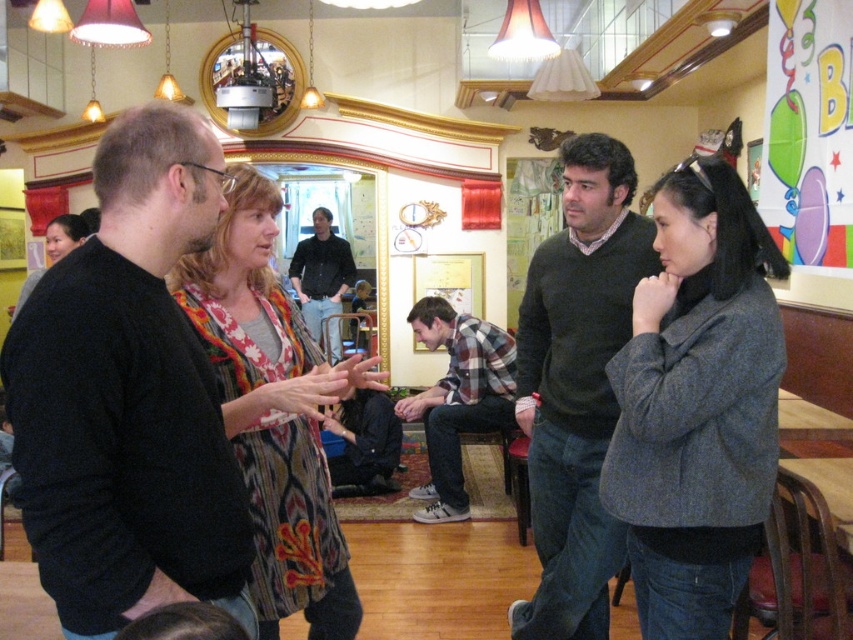
Question: Is flannel shirt at center below dark blue jeans at center?

Choices:
 (A) no
 (B) yes

Answer: (B)

Question: Among these objects, which one is farthest from the camera?

Choices:
 (A) multicolored woven scarf at center
 (B) dark blue jeans at center
 (C) flannel shirt at center

Answer: (B)

Question: Which object is the closest to the gray woolen jacket at right?

Choices:
 (A) dark blue jeans at center
 (B) multicolored woven scarf at center

Answer: (B)

Question: Is black matte sweater at left to the right of dark gray sweater at center from the viewer's perspective?

Choices:
 (A) no
 (B) yes

Answer: (A)

Question: Which of these objects is positioned farthest from the dark gray sweater at center?

Choices:
 (A) dark blue jeans at center
 (B) gray woolen jacket at right
 (C) black matte sweater at left

Answer: (A)

Question: Can you confirm if gray woolen jacket at right is positioned above flannel shirt at center?

Choices:
 (A) no
 (B) yes

Answer: (B)